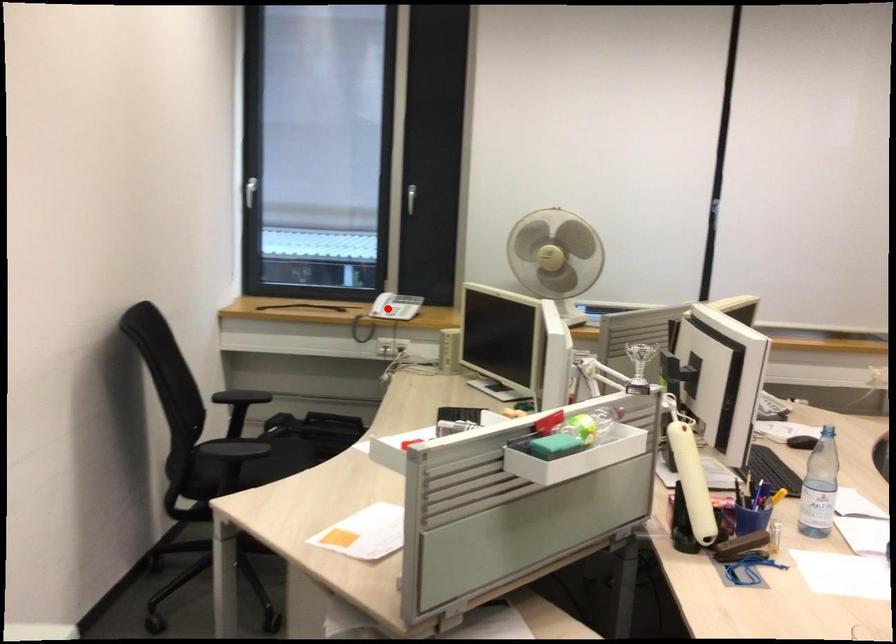
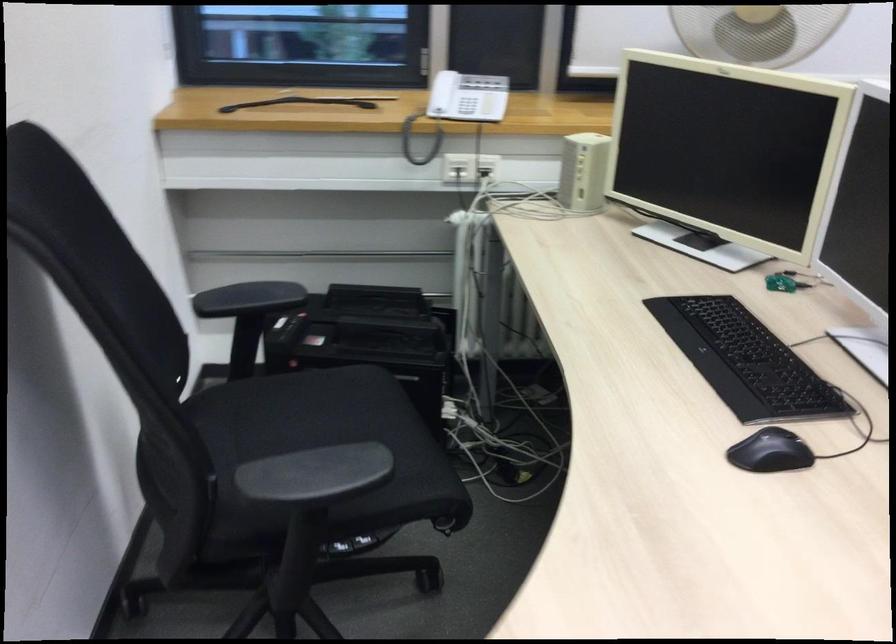
Question: I am providing you with two images of the same scene from different viewpoints. A red point is shown in image1. For the corresponding object point in image2, is it positioned nearer or farther from the camera?

Choices:
 (A) Nearer
 (B) Farther

Answer: (A)